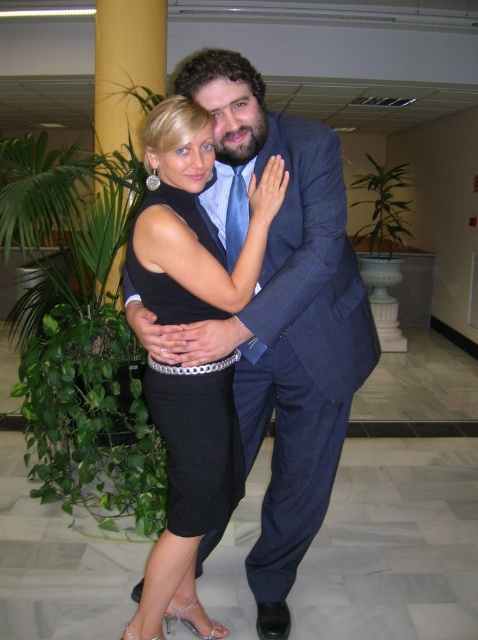
What is the exact position of the satin black dress at center in the image?

The satin black dress at center is located at point coordinates of (185, 497).

You are a photographer at the event and need to adjust the lighting to highlight the black dress at center. Since the dress is positioned at point [185,497], where should you direct the spotlight?

The point [185,497] marks the black dress at center, so you should direct the spotlight to that coordinate to highlight it.